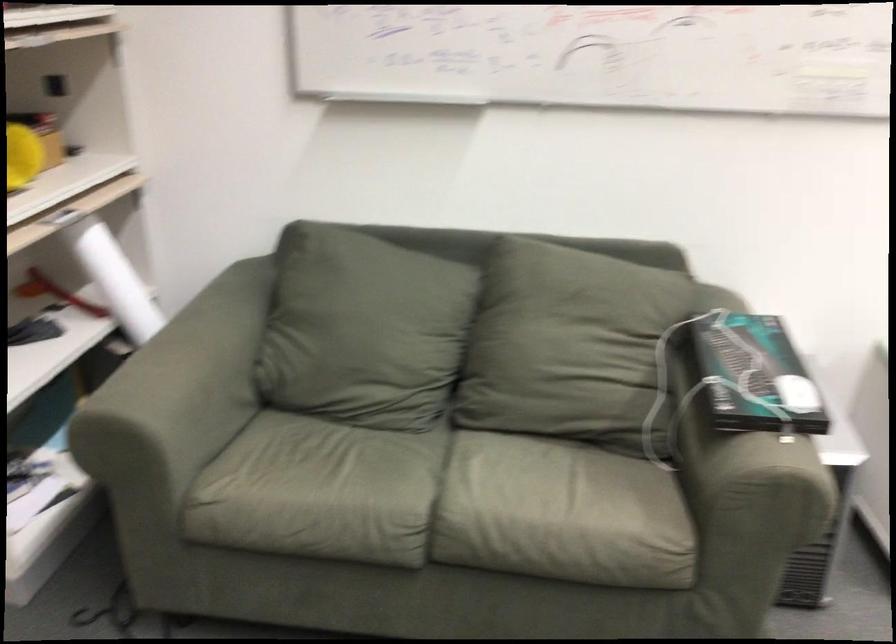
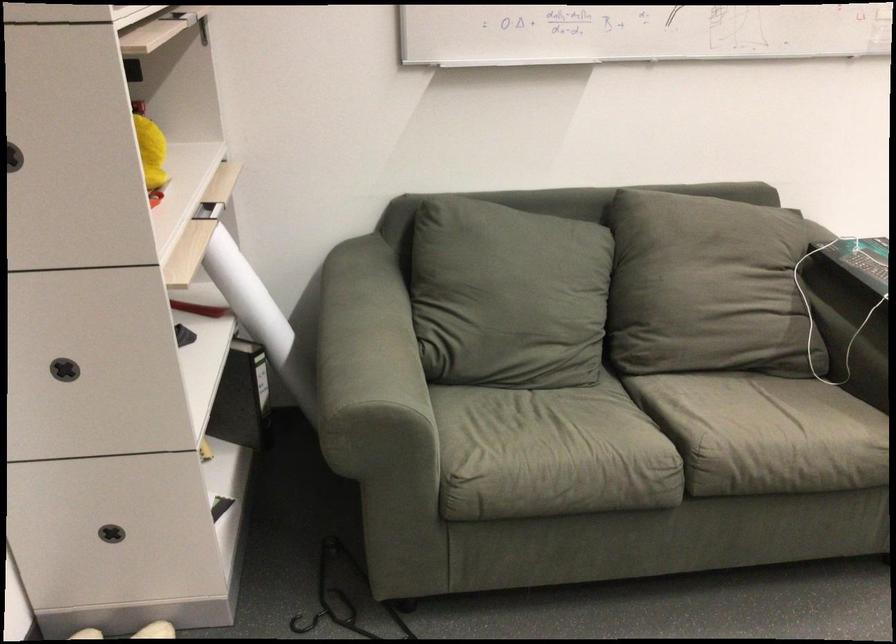
Locate, in the second image, the point that corresponds to point 352,330 in the first image.

(506, 295)